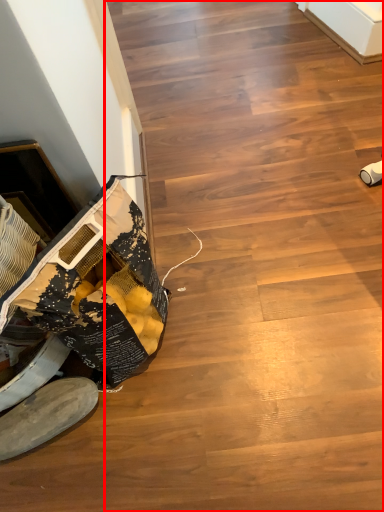
Question: Observing the image, what is the correct spatial positioning of stairwell (annotated by the red box) in reference to footwear?

Choices:
 (A) right
 (B) left

Answer: (A)